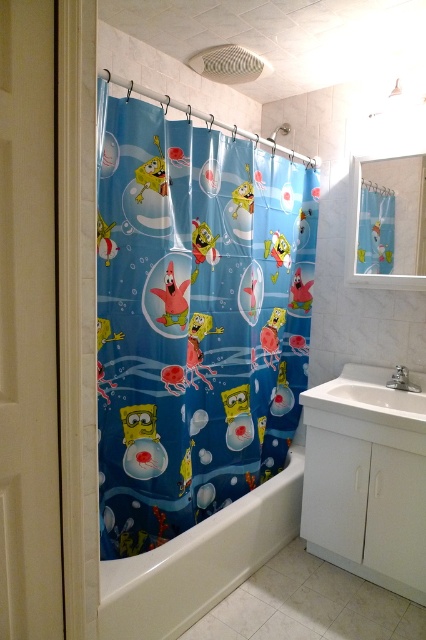
Can you confirm if white glossy sink at lower right is thinner than blue fabric sponge at upper right?

In fact, white glossy sink at lower right might be wider than blue fabric sponge at upper right.

Describe the element at coordinates (368, 406) in the screenshot. The image size is (426, 640). I see `white glossy sink at lower right` at that location.

Locate an element on the screen. white glossy sink at lower right is located at coordinates [368, 406].

How far apart are blue plastic cartoon characters at center and white glossy sink at lower right?

The distance of blue plastic cartoon characters at center from white glossy sink at lower right is 23.80 inches.

Is point (236, 452) closer to camera compared to point (400, 392)?

No, it is not.

Between point (152, 332) and point (305, 419), which one is positioned behind?

The point (305, 419) is more distant.

What are the coordinates of `blue plastic cartoon characters at center` in the screenshot? It's located at (195, 317).

Which is behind, point (181, 564) or point (347, 368)?

The point (347, 368) is behind.

From the picture: Is white glossy bathtub at lower center thinner than white glossy sink at lower right?

No.

Who is more distant from viewer, (249, 561) or (423, 445)?

The point (249, 561) is behind.

The height and width of the screenshot is (640, 426). What are the coordinates of `white glossy bathtub at lower center` in the screenshot? It's located at (199, 561).